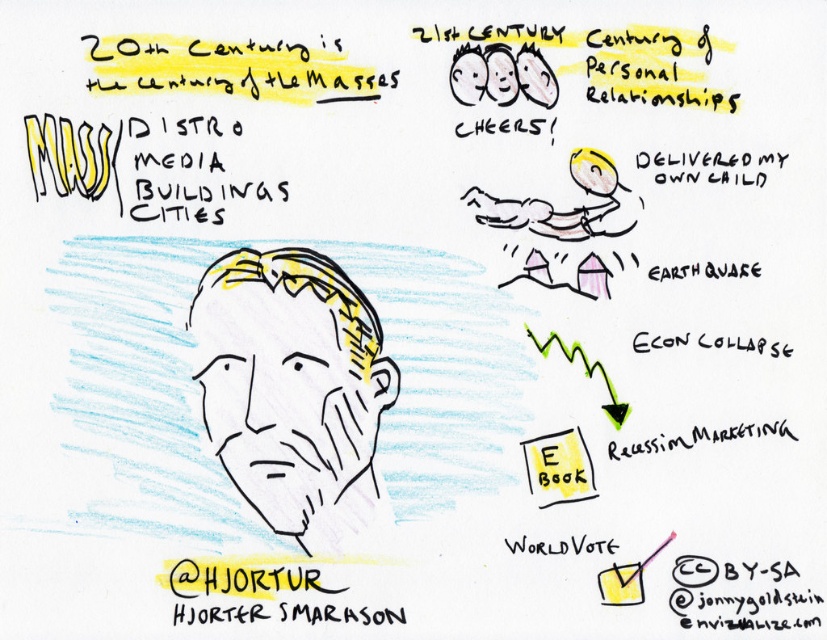
Based on the coordinates provided in the scene description, where would you find the black line drawing of a man at center?

The black line drawing of a man at center is located at point (292, 388).

Where is the black line drawing of a man at center located in the image?

The black line drawing of a man at center is located at point (292, 388).